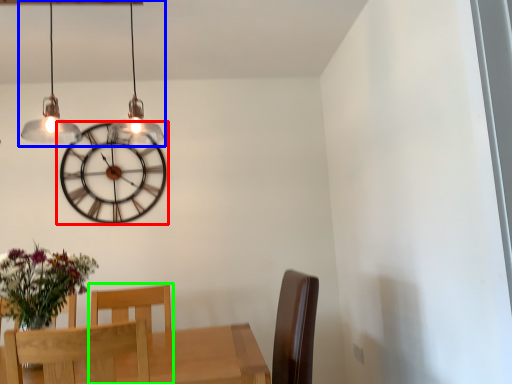
Question: Considering the real-world distances, which object is farthest from wall clock (highlighted by a red box)? lamp (highlighted by a blue box) or chair (highlighted by a green box)?

Choices:
 (A) lamp
 (B) chair

Answer: (B)